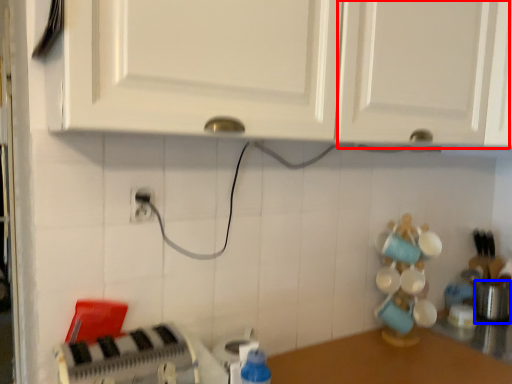
Question: Among these objects, which one is nearest to the camera, cabinetry (highlighted by a red box) or appliance (highlighted by a blue box)?

Choices:
 (A) cabinetry
 (B) appliance

Answer: (A)